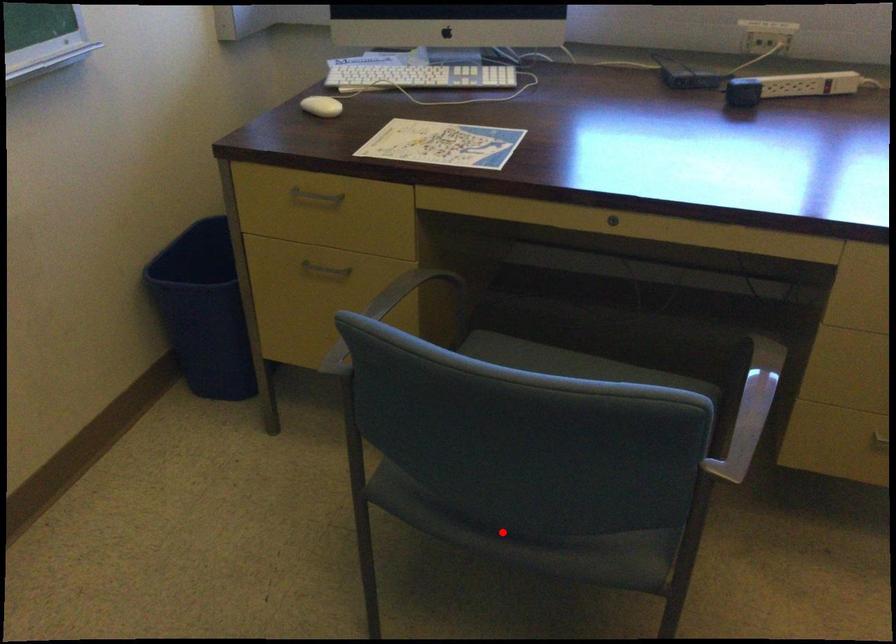
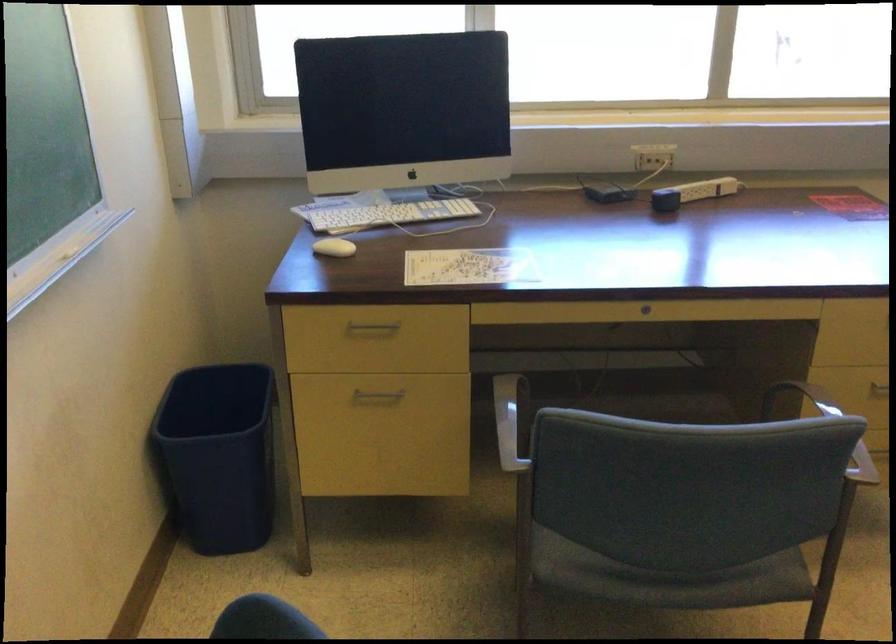
Question: I am providing you with two images of the same scene from different viewpoints. In image1, a red point is highlighted. Considering the same 3D point in image2, which of the following is correct?

Choices:
 (A) It is closer
 (B) It is farther

Answer: (B)